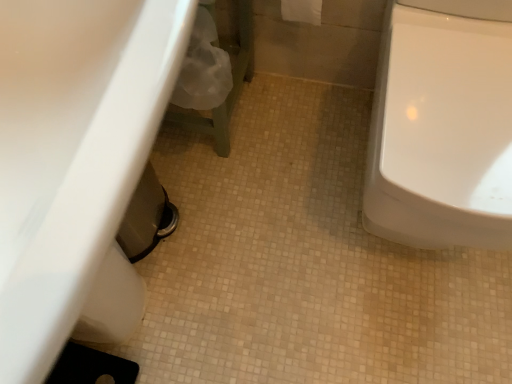
Question: From the image's perspective, is white fabric toilet paper at upper center beneath white glossy sink at lower left?

Choices:
 (A) yes
 (B) no

Answer: (B)

Question: Is white fabric toilet paper at upper center aimed at white glossy sink at lower left?

Choices:
 (A) yes
 (B) no

Answer: (B)

Question: Is white fabric toilet paper at upper center far away from white glossy sink at lower left?

Choices:
 (A) yes
 (B) no

Answer: (B)

Question: Is white fabric toilet paper at upper center wider than white glossy sink at lower left?

Choices:
 (A) yes
 (B) no

Answer: (B)

Question: From a real-world perspective, does white fabric toilet paper at upper center sit lower than white glossy sink at lower left?

Choices:
 (A) no
 (B) yes

Answer: (A)

Question: From a real-world perspective, is white fabric toilet paper at upper center above or below white glossy toilet at right?

Choices:
 (A) above
 (B) below

Answer: (A)

Question: Does point [287, 14] appear closer or farther from the camera than point [480, 56]?

Choices:
 (A) closer
 (B) farther

Answer: (B)

Question: Is white fabric toilet paper at upper center wider or thinner than white glossy toilet at right?

Choices:
 (A) wide
 (B) thin

Answer: (B)

Question: Is white fabric toilet paper at upper center situated inside white glossy toilet at right or outside?

Choices:
 (A) inside
 (B) outside

Answer: (B)

Question: Is point (494, 82) closer or farther from the camera than point (294, 11)?

Choices:
 (A) farther
 (B) closer

Answer: (B)

Question: From the image's perspective, is white glossy toilet at right above or below white fabric toilet paper at upper center?

Choices:
 (A) below
 (B) above

Answer: (A)

Question: Is white glossy toilet at right bigger or smaller than white fabric toilet paper at upper center?

Choices:
 (A) small
 (B) big

Answer: (B)

Question: Is white glossy toilet at right taller or shorter than white fabric toilet paper at upper center?

Choices:
 (A) short
 (B) tall

Answer: (B)

Question: Considering the positions of white glossy toilet at right and white glossy sink at lower left in the image, is white glossy toilet at right wider or thinner than white glossy sink at lower left?

Choices:
 (A) wide
 (B) thin

Answer: (A)

Question: From a real-world perspective, is white glossy toilet at right above or below white glossy sink at lower left?

Choices:
 (A) below
 (B) above

Answer: (A)